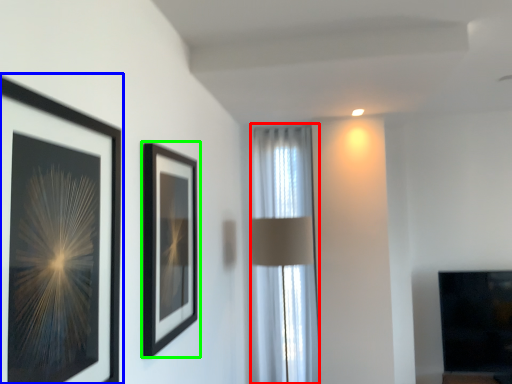
Question: Based on their relative distances, which object is nearer to curtain (highlighted by a red box)? Choose from picture frame (highlighted by a blue box) and picture frame (highlighted by a green box).

Choices:
 (A) picture frame
 (B) picture frame

Answer: (B)